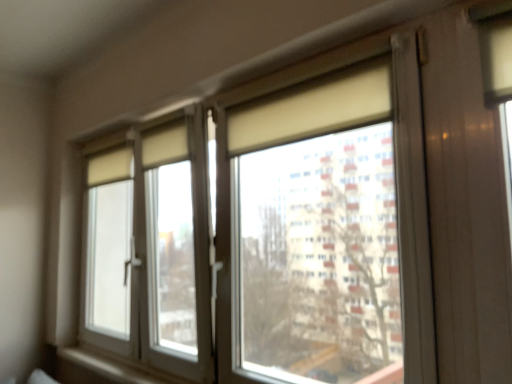
In the scene shown: What is the approximate height of white matte window sill at lower left?

1.75 inches.

This screenshot has width=512, height=384. What are the coordinates of `white matte window sill at lower left` in the screenshot? It's located at (101, 368).

The image size is (512, 384). What do you see at coordinates (101, 368) in the screenshot? I see `white matte window sill at lower left` at bounding box center [101, 368].

Locate an element on the screen. The image size is (512, 384). matte glass window at center is located at coordinates (277, 229).

What do you see at coordinates (277, 229) in the screenshot? I see `matte glass window at center` at bounding box center [277, 229].

Image resolution: width=512 pixels, height=384 pixels. I want to click on white matte window sill at lower left, so click(x=101, y=368).

Is white matte window sill at lower left at the right side of matte glass window at center?

No, white matte window sill at lower left is not to the right of matte glass window at center.

Which object is more forward, white matte window sill at lower left or matte glass window at center?

Positioned in front is matte glass window at center.

Considering the positions of point (115, 359) and point (334, 119), is point (115, 359) closer or farther from the camera than point (334, 119)?

Point (115, 359) is positioned farther from the camera compared to point (334, 119).

From the image's perspective, is white matte window sill at lower left above or below matte glass window at center?

Clearly, from the image's perspective, white matte window sill at lower left is below matte glass window at center.

From a real-world perspective, between white matte window sill at lower left and matte glass window at center, who is vertically lower?

white matte window sill at lower left.

Looking at their sizes, would you say white matte window sill at lower left is wider or thinner than matte glass window at center?

Clearly, white matte window sill at lower left has less width compared to matte glass window at center.

Considering the relative sizes of white matte window sill at lower left and matte glass window at center in the image provided, is white matte window sill at lower left shorter than matte glass window at center?

Yes, white matte window sill at lower left is shorter than matte glass window at center.

From the picture: Looking at the image, does white matte window sill at lower left seem bigger or smaller compared to matte glass window at center?

white matte window sill at lower left is smaller than matte glass window at center.

Based on the photo, choose the correct answer: Is white matte window sill at lower left inside matte glass window at center or outside it?

white matte window sill at lower left is contained in matte glass window at center.

Is white matte window sill at lower left not close to matte glass window at center?

They are positioned close to each other.

Is white matte window sill at lower left oriented away from matte glass window at center?

Yes, white matte window sill at lower left's orientation is away from matte glass window at center.

How many degrees apart are the facing directions of white matte window sill at lower left and matte glass window at center?

white matte window sill at lower left and matte glass window at center are facing 0.248 degrees away from each other.

At what (x,y) coordinates should I click in order to perform the action: click on window that appears on the right of white matte window sill at lower left. Please return your answer as a coordinate pair (x, y). Looking at the image, I should click on (277, 229).

Which object is positioned more to the left, matte glass window at center or white matte window sill at lower left?

white matte window sill at lower left is more to the left.

Which object is more forward, matte glass window at center or white matte window sill at lower left?

Positioned in front is matte glass window at center.

Is point (331, 304) closer to camera compared to point (137, 371)?

Yes.

Looking at this image, from the image's perspective, is matte glass window at center above or below white matte window sill at lower left?

From the image's perspective, matte glass window at center appears above white matte window sill at lower left.

From a real-world perspective, is matte glass window at center positioned above or below white matte window sill at lower left?

matte glass window at center is situated higher than white matte window sill at lower left in the real world.

Considering the sizes of matte glass window at center and white matte window sill at lower left in the image, is matte glass window at center wider or thinner than white matte window sill at lower left?

Considering their sizes, matte glass window at center looks broader than white matte window sill at lower left.

Considering the sizes of objects matte glass window at center and white matte window sill at lower left in the image provided, who is shorter, matte glass window at center or white matte window sill at lower left?

Standing shorter between the two is white matte window sill at lower left.

In terms of size, does matte glass window at center appear bigger or smaller than white matte window sill at lower left?

In the image, matte glass window at center appears to be larger than white matte window sill at lower left.

Is white matte window sill at lower left a part of matte glass window at center?

Yes, white matte window sill at lower left is a part of matte glass window at center.

Is matte glass window at center beside white matte window sill at lower left?

No, matte glass window at center is not next to white matte window sill at lower left.

Is matte glass window at center aimed at white matte window sill at lower left?

No, matte glass window at center is not facing towards white matte window sill at lower left.

Consider the image. How many degrees apart are the facing directions of matte glass window at center and white matte window sill at lower left?

There is a 0.248-degree angle between the facing directions of matte glass window at center and white matte window sill at lower left.

In order to click on window that is on the right side of white matte window sill at lower left in this screenshot , I will do `click(277, 229)`.

Find the location of a particular element. window sill below the matte glass window at center (from a real-world perspective) is located at coordinates (101, 368).

This screenshot has width=512, height=384. I want to click on window on the right of the white matte window sill at lower left, so click(x=277, y=229).